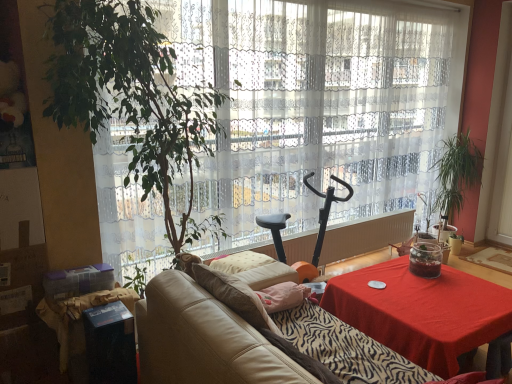
Question: Is black cardboard box at lower left thinner than translucent glass jar at center?

Choices:
 (A) no
 (B) yes

Answer: (A)

Question: Does black cardboard box at lower left lie in front of translucent glass jar at center?

Choices:
 (A) yes
 (B) no

Answer: (A)

Question: Does black cardboard box at lower left have a lesser height compared to translucent glass jar at center?

Choices:
 (A) yes
 (B) no

Answer: (B)

Question: Are black cardboard box at lower left and translucent glass jar at center far apart?

Choices:
 (A) yes
 (B) no

Answer: (A)

Question: Can you confirm if black cardboard box at lower left is smaller than translucent glass jar at center?

Choices:
 (A) no
 (B) yes

Answer: (A)

Question: Would you say red cloth-covered table at lower right is to the left or to the right of green leafy plant at right in the picture?

Choices:
 (A) left
 (B) right

Answer: (A)

Question: Considering the positions of red cloth-covered table at lower right and green leafy plant at right in the image, is red cloth-covered table at lower right wider or thinner than green leafy plant at right?

Choices:
 (A) wide
 (B) thin

Answer: (A)

Question: Do you think red cloth-covered table at lower right is within green leafy plant at right, or outside of it?

Choices:
 (A) outside
 (B) inside

Answer: (A)

Question: In terms of height, does red cloth-covered table at lower right look taller or shorter compared to green leafy plant at right?

Choices:
 (A) tall
 (B) short

Answer: (B)

Question: In terms of height, does leather couch at center look taller or shorter compared to black plastic exercise bike at center?

Choices:
 (A) tall
 (B) short

Answer: (B)

Question: In terms of width, does leather couch at center look wider or thinner when compared to black plastic exercise bike at center?

Choices:
 (A) thin
 (B) wide

Answer: (B)

Question: Looking at the image, does leather couch at center seem bigger or smaller compared to black plastic exercise bike at center?

Choices:
 (A) small
 (B) big

Answer: (B)

Question: Is point (220, 339) positioned closer to the camera than point (323, 206)?

Choices:
 (A) closer
 (B) farther

Answer: (A)

Question: Considering their positions, is green leafy plant at right located in front of or behind leather couch at center?

Choices:
 (A) front
 (B) behind

Answer: (B)

Question: Is green leafy plant at right bigger or smaller than leather couch at center?

Choices:
 (A) small
 (B) big

Answer: (A)